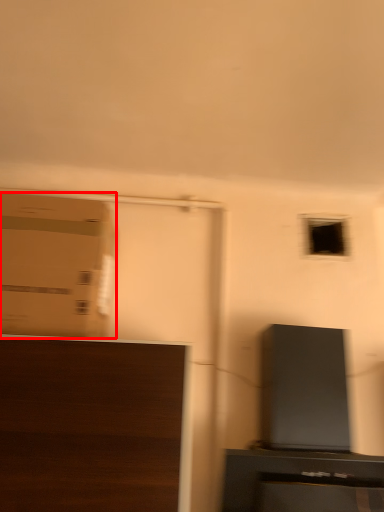
Question: From the image's perspective, where is cardboard box (annotated by the red box) located relative to furniture?

Choices:
 (A) above
 (B) below

Answer: (A)